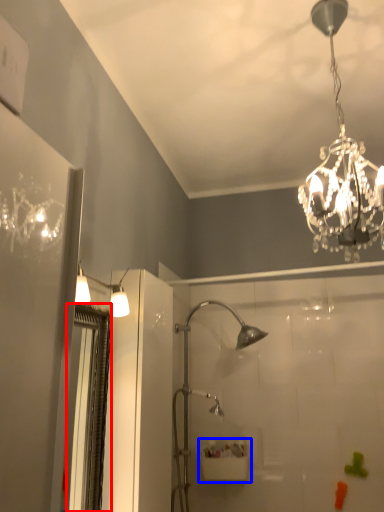
Question: Which of the following is the farthest to the observer, screen door (highlighted by a red box) or sink (highlighted by a blue box)?

Choices:
 (A) screen door
 (B) sink

Answer: (B)